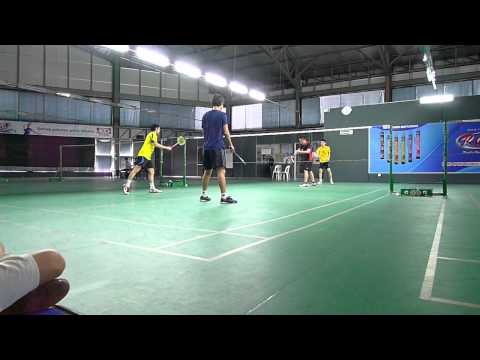
Locate an element on the screen. This screenshot has width=480, height=360. chairs is located at coordinates (x=274, y=168), (x=284, y=172).